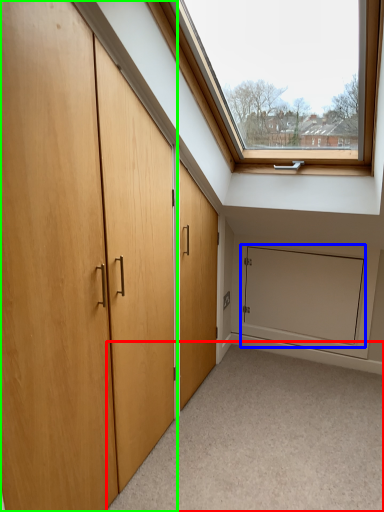
Question: Based on their relative distances, which object is farther from corridor (highlighted by a red box)? Choose from screen door (highlighted by a blue box) and door (highlighted by a green box).

Choices:
 (A) screen door
 (B) door

Answer: (B)